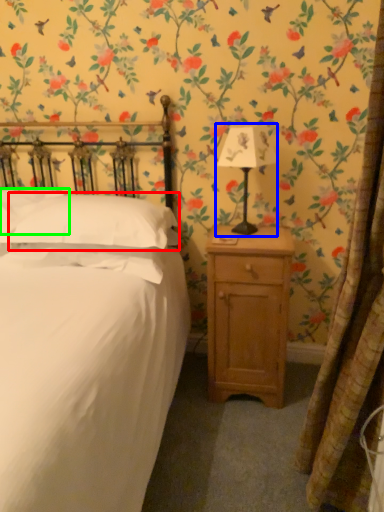
Question: Which is nearer to the pillow (highlighted by a red box)? bedside lamp (highlighted by a blue box) or pillow (highlighted by a green box).

Choices:
 (A) bedside lamp
 (B) pillow

Answer: (B)